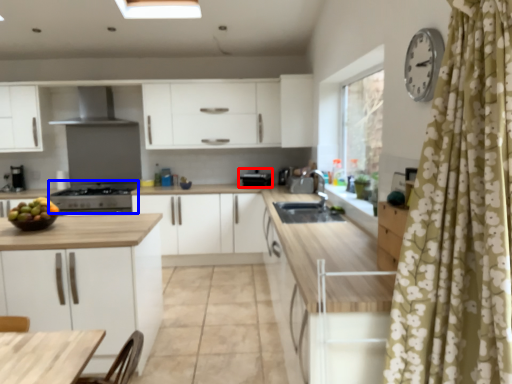
Question: Among these objects, which one is nearest to the camera, appliance (highlighted by a red box) or appliance (highlighted by a blue box)?

Choices:
 (A) appliance
 (B) appliance

Answer: (B)